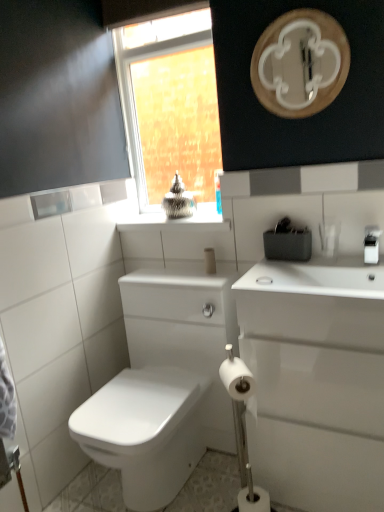
What do you see at coordinates (209, 261) in the screenshot? I see `white matte cylindrical container at center` at bounding box center [209, 261].

Find the location of `white matte toilet paper at lower center, which is counted as the 1th toilet paper, starting from the top`. white matte toilet paper at lower center, which is counted as the 1th toilet paper, starting from the top is located at coordinates (239, 382).

In order to face white matte toilet paper at lower center, which is the first toilet paper in bottom-to-top order, should I rotate leftwards or rightwards?

You should look right and rotate roughly 8.339 degrees.

Measure the distance between white matte toilet paper at lower center, the 2th toilet paper from the top, and camera.

The distance of white matte toilet paper at lower center, the 2th toilet paper from the top, from camera is 5.07 feet.

At what (x,y) coordinates should I click in order to perform the action: click on white glossy sink at right. Please return your answer as a coordinate pair (x, y). The width and height of the screenshot is (384, 512). Looking at the image, I should click on (316, 380).

Measure the distance between white glossy sink at right and camera.

The depth of white glossy sink at right is 3.94 feet.

Identify the location of white glossy counter top at upper center. Image resolution: width=384 pixels, height=512 pixels. (177, 221).

I want to click on clear glass window at upper center, so click(169, 104).

Locate an element on the screen. This screenshot has width=384, height=512. white glossy mirror at upper center is located at coordinates (300, 63).

Find the location of a particular element. Image resolution: width=384 pixels, height=512 pixels. white matte cylindrical container at center is located at coordinates (209, 261).

From a real-world perspective, which object stands above the other?

In real-world perspective, white matte cylindrical container at center is above.

From the image's perspective, is white matte cylindrical container at center over white glossy sink at right?

Yes.

Considering the relative positions of white matte cylindrical container at center and white glossy sink at right in the image provided, is white matte cylindrical container at center to the right of white glossy sink at right from the viewer's perspective?

In fact, white matte cylindrical container at center is to the left of white glossy sink at right.

Between white matte cylindrical container at center and white glossy sink at right, which one has smaller size?

Smaller between the two is white matte cylindrical container at center.

Is white matte cylindrical container at center inside or outside of clear glass window at upper center?

white matte cylindrical container at center is spatially situated outside clear glass window at upper center.

Considering the relative positions of white matte cylindrical container at center and clear glass window at upper center in the image provided, is white matte cylindrical container at center behind clear glass window at upper center?

Yes.

Considering the points (208, 271) and (148, 42), which point is behind, point (208, 271) or point (148, 42)?

The point (148, 42) is behind.

Is white matte soap at center oriented away from white glossy sink at right?

Yes, white matte soap at center's orientation is away from white glossy sink at right.

Looking at this image, looking at their sizes, would you say white matte soap at center is wider or thinner than white glossy sink at right?

Clearly, white matte soap at center has less width compared to white glossy sink at right.

Which is behind, white matte soap at center or white glossy sink at right?

white matte soap at center is further from the camera.

Where is `porcelain in front of the white matte soap at center`? porcelain in front of the white matte soap at center is located at coordinates (316, 380).

Is white glossy sink at right turned away from white matte toilet paper at lower center, which is the first toilet paper in bottom-to-top order?

No, white glossy sink at right is not facing the opposite direction of white matte toilet paper at lower center, which is the first toilet paper in bottom-to-top order.

Considering the relative sizes of white glossy sink at right and white matte toilet paper at lower center, the 2th toilet paper from the top, in the image provided, is white glossy sink at right thinner than white matte toilet paper at lower center, the 2th toilet paper from the top,?

Incorrect, the width of white glossy sink at right is not less than that of white matte toilet paper at lower center, the 2th toilet paper from the top.

From the image's perspective, which one is positioned lower, white glossy sink at right or white matte toilet paper at lower center, the 2th toilet paper from the top?

white matte toilet paper at lower center, the 2th toilet paper from the top, appears lower in the image.

Is white glossy sink at right beside white matte toilet paper at lower center, which is the first toilet paper in bottom-to-top order?

No, white glossy sink at right is not in contact with white matte toilet paper at lower center, which is the first toilet paper in bottom-to-top order.

From a real-world perspective, which object stands above the other?

white glossy mirror at upper center, from a real-world perspective.

Can we say white glossy sink at right lies outside white glossy mirror at upper center?

Yes, white glossy sink at right is located beyond the bounds of white glossy mirror at upper center.

From the image's perspective, which object appears higher, white glossy sink at right or white glossy mirror at upper center?

From the image's view, white glossy mirror at upper center is above.

Considering the relative positions of white glossy sink at right and white glossy mirror at upper center in the image provided, is white glossy sink at right to the left of white glossy mirror at upper center from the viewer's perspective?

No.

Considering the sizes of objects clear glass window at upper center and white matte cylindrical container at center in the image provided, who is bigger, clear glass window at upper center or white matte cylindrical container at center?

Bigger between the two is clear glass window at upper center.

Between clear glass window at upper center and white matte cylindrical container at center, which one has larger width?

With larger width is white matte cylindrical container at center.

In terms of height, does clear glass window at upper center look taller or shorter compared to white matte cylindrical container at center?

clear glass window at upper center is taller than white matte cylindrical container at center.

Considering the points (331, 454) and (267, 276), which point is in front, point (331, 454) or point (267, 276)?

The point (331, 454) is in front.

Is white glossy sink at right located outside white matte soap at center?

Yes, white glossy sink at right is not within white matte soap at center.

In the scene shown: Is white glossy sink at right to the left of white matte soap at center from the viewer's perspective?

No, white glossy sink at right is not to the left of white matte soap at center.

Which of these two, white glossy sink at right or white matte soap at center, is wider?

With larger width is white glossy sink at right.

This screenshot has width=384, height=512. I want to click on porcelain that is under the white matte cylindrical container at center (from a real-world perspective), so click(x=316, y=380).

In the image, there is a clear glass window at upper center. At what (x,y) coordinates should I click in order to perform the action: click on toiletry below it (from the image's perspective). Please return your answer as a coordinate pair (x, y). The image size is (384, 512). Looking at the image, I should click on (209, 261).

Considering their positions, is clear glass window at upper center positioned further to white matte cylindrical container at center than white glossy mirror at upper center?

Based on the image, white glossy mirror at upper center appears to be further to white matte cylindrical container at center.

Estimate the real-world distances between objects in this image. Which object is further from white glossy counter top at upper center, white matte soap at center or white matte toilet paper at lower center, the 2th toilet paper from the top?

The object further to white glossy counter top at upper center is white matte toilet paper at lower center, the 2th toilet paper from the top.

Looking at the image, which one is located closer to white matte cylindrical container at center, white matte toilet paper at lower center, which is counted as the 1th toilet paper, starting from the top, or clear glass window at upper center?

Among the two, white matte toilet paper at lower center, which is counted as the 1th toilet paper, starting from the top, is located nearer to white matte cylindrical container at center.

When comparing their distances from white glossy counter top at upper center, does white matte cylindrical container at center or white matte toilet paper at lower center, the 2th toilet paper from the top, seem closer?

Based on the image, white matte cylindrical container at center appears to be nearer to white glossy counter top at upper center.

Looking at the image, which one is located further to white glossy mirror at upper center, white glossy counter top at upper center or white matte cylindrical container at center?

A: white matte cylindrical container at center lies further to white glossy mirror at upper center than the other object.

From the image, which object appears to be nearer to clear glass window at upper center, white matte cylindrical container at center or white glossy mirror at upper center?

white glossy mirror at upper center.

Based on their spatial positions, is clear glass window at upper center or white matte toilet paper at lower center, arranged as the 2th toilet paper when ordered from the bottom, further from white glossy sink at right?

clear glass window at upper center lies further to white glossy sink at right than the other object.

Estimate the real-world distances between objects in this image. Which object is further from clear glass window at upper center, white glossy mirror at upper center or white matte toilet paper at lower center, which is counted as the 1th toilet paper, starting from the top?

white matte toilet paper at lower center, which is counted as the 1th toilet paper, starting from the top, is further to clear glass window at upper center.

This screenshot has height=512, width=384. In order to click on toilet paper between white glossy mirror at upper center and white matte toilet paper at lower center, which is the first toilet paper in bottom-to-top order, from top to bottom in this screenshot , I will do coord(239,382).

Locate an element on the screen. The width and height of the screenshot is (384, 512). soap that lies between white glossy counter top at upper center and white matte toilet paper at lower center, which is the first toilet paper in bottom-to-top order, from top to bottom is located at coordinates (264, 280).

Where is `counter top between white glossy mirror at upper center and white matte toilet paper at lower center, which is counted as the 1th toilet paper, starting from the top, in the up-down direction`? counter top between white glossy mirror at upper center and white matte toilet paper at lower center, which is counted as the 1th toilet paper, starting from the top, in the up-down direction is located at coordinates (177, 221).

Where is `porcelain between white matte soap at center and white matte toilet paper at lower center, which is the first toilet paper in bottom-to-top order, vertically`? Image resolution: width=384 pixels, height=512 pixels. porcelain between white matte soap at center and white matte toilet paper at lower center, which is the first toilet paper in bottom-to-top order, vertically is located at coordinates 316,380.